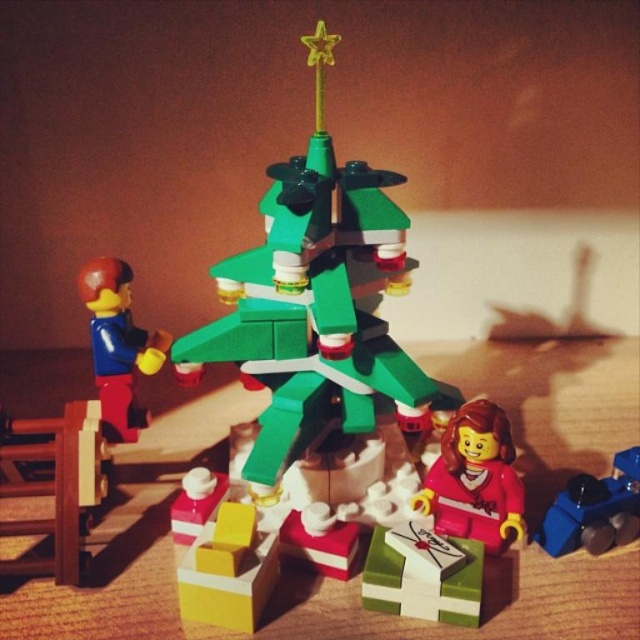
You are trying to place a new LEGO accessory that is 10 cm wide between the smooth red minifigure at center and the blue plastic train at lower right. Based on their widths, will it fit?

The smooth red minifigure at center has a lesser width compared to blue plastic train at lower right. Since the accessory is 10 cm wide, it depends on the available space between them. However, the description only provides information about their widths, not the distance between them. Therefore, we cannot determine if the accessory will fit based solely on the given information.

You are a LEGO enthusiast who wants to place a new LEGO accessory between the smooth red minifigure at center and the blue plastic train at lower right. Based on their positions, which object should the accessory be closer to?

The smooth red minifigure at center is in front of the blue plastic train at lower right, so the accessory should be placed closer to the blue plastic train at lower right to maintain the spatial relationship between them.